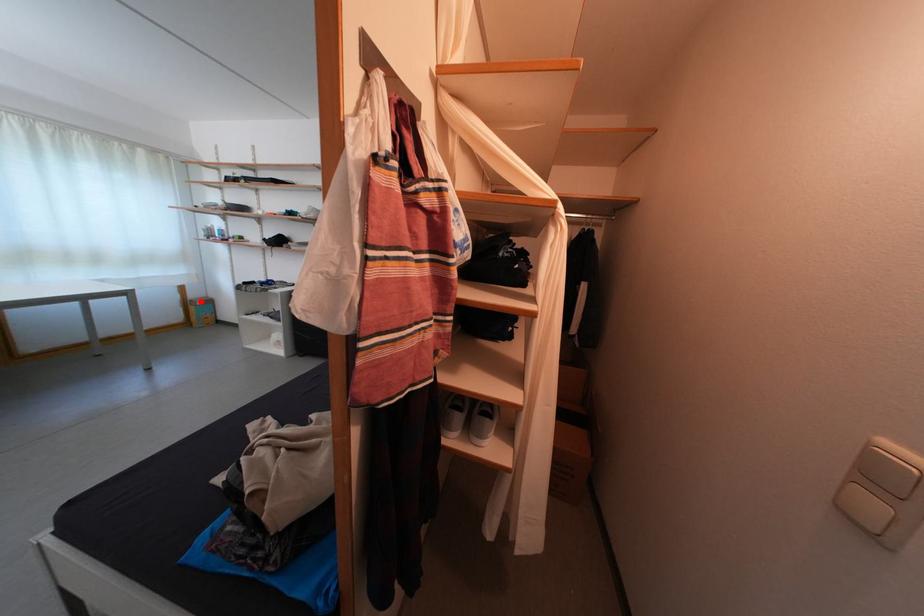
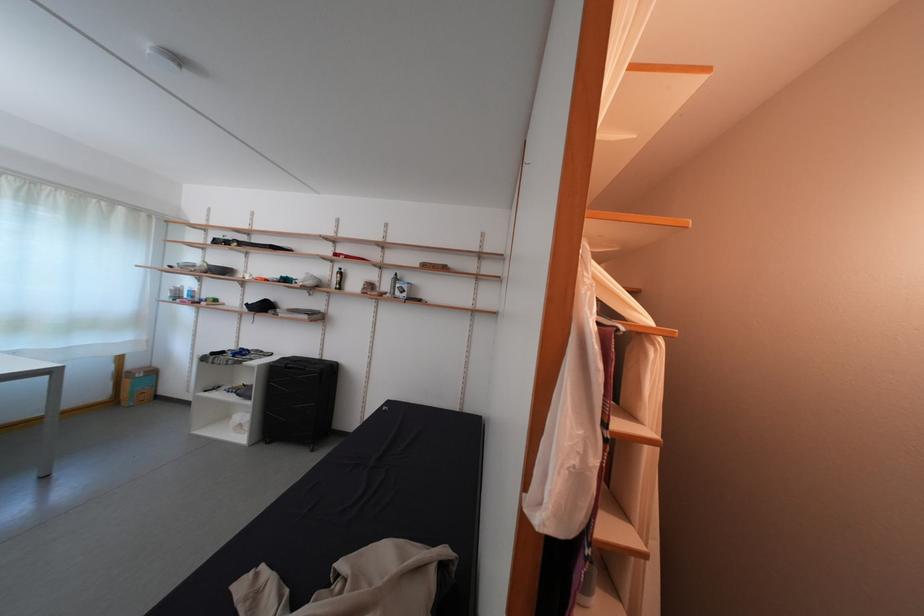
In the second image, find the point that corresponds to the highlighted location in the first image.

(140, 371)